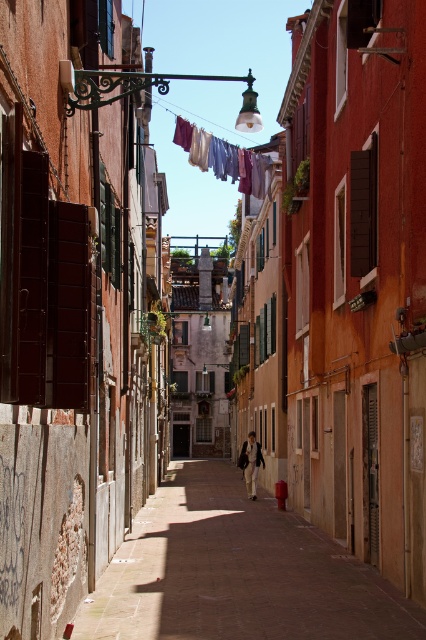
You are a tourist in this historic alleyway and notice a multicolored fabric hanging between two buildings. The fabric is marked by the point at coordinates point [222,157]. If you are standing at the entrance of the alleyway, which direction should you walk to reach the fabric?

The multicolored fabric at center is represented by point [222,157], so you should walk towards the center of the alleyway to reach it.

You are standing in the narrow alleyway described in the scene. If you look at the point with coordinates (236,572), what type of surface will you see there?

The point at (236,572) corresponds to the smooth stone alley at center, so you will see a smooth stone surface there.